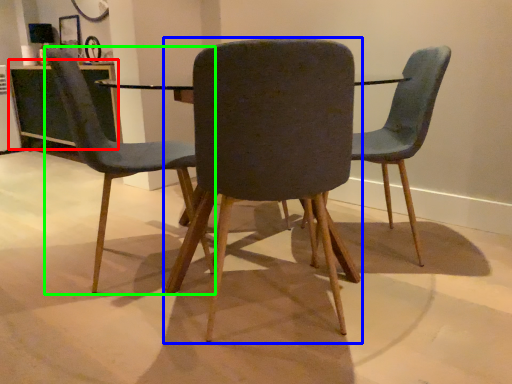
Question: Estimate the real-world distances between objects in this image. Which object is closer to table (highlighted by a red box), chair (highlighted by a blue box) or chair (highlighted by a green box)?

Choices:
 (A) chair
 (B) chair

Answer: (B)